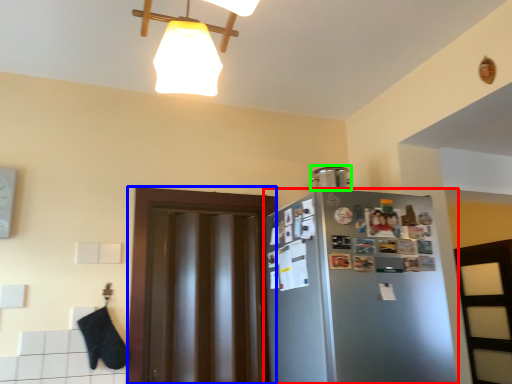
Question: Which object is the closest to the refrigerator (highlighted by a red box)? Choose among these: glass door (highlighted by a blue box) or appliance (highlighted by a green box).

Choices:
 (A) glass door
 (B) appliance

Answer: (A)